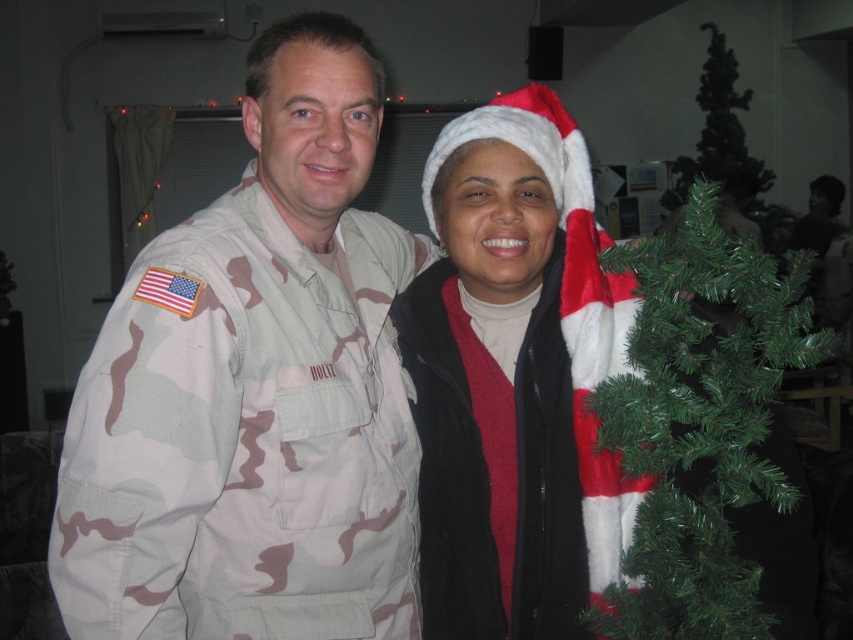
Question: Is white fuzzy santa hat at center below green artificial christmas tree at right?

Choices:
 (A) yes
 (B) no

Answer: (B)

Question: Considering the real-world distances, which object is closest to the white fuzzy santa hat at center?

Choices:
 (A) green artificial christmas tree at right
 (B) camo uniform at left

Answer: (A)

Question: Considering the real-world distances, which object is closest to the camo uniform at left?

Choices:
 (A) green artificial christmas tree at right
 (B) white fuzzy santa hat at center

Answer: (B)

Question: Can you confirm if camo uniform at left is positioned to the left of green artificial christmas tree at right?

Choices:
 (A) yes
 (B) no

Answer: (A)

Question: Can you confirm if camo uniform at left is wider than white fuzzy santa hat at center?

Choices:
 (A) no
 (B) yes

Answer: (B)

Question: Which object appears closest to the camera in this image?

Choices:
 (A) green artificial christmas tree at right
 (B) white fuzzy santa hat at center
 (C) camo uniform at left

Answer: (C)